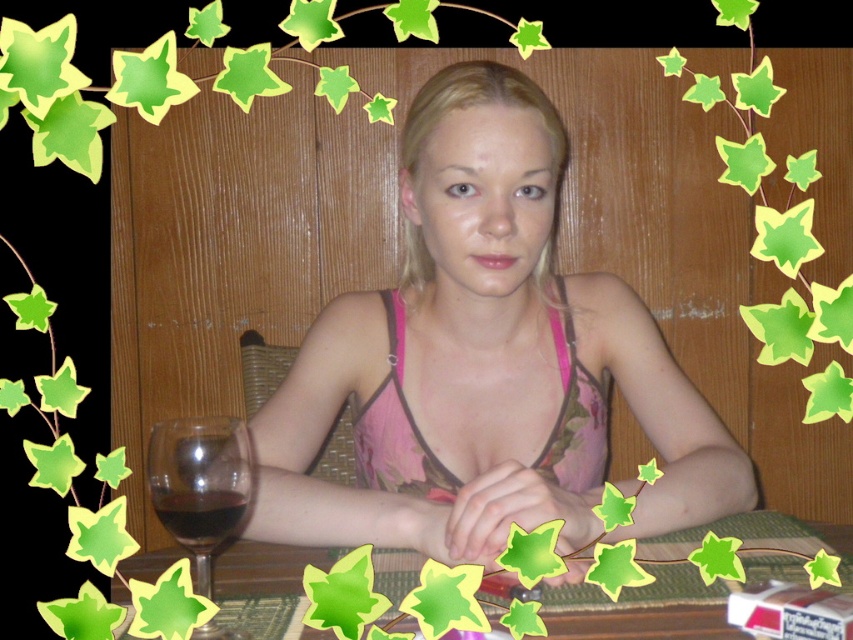
Is transparent glass at lower left positioned in front of dark red liquid at lower left?

Yes, transparent glass at lower left is closer to the viewer.

From the picture: Who is shorter, transparent glass at lower left or dark red liquid at lower left?

dark red liquid at lower left is shorter.

What do you see at coordinates (200, 483) in the screenshot?
I see `transparent glass at lower left` at bounding box center [200, 483].

You are a GUI agent. You are given a task and a screenshot of the screen. Output one action in this format:
    pyautogui.click(x=<x>, y=<y>)
    Task: Click on the transparent glass at lower left
    
    Given the screenshot: What is the action you would take?
    pyautogui.click(x=200, y=483)

Who is shorter, pink floral dress at center or dark red liquid at lower left?

Standing shorter between the two is dark red liquid at lower left.

This screenshot has height=640, width=853. I want to click on pink floral dress at center, so click(x=485, y=362).

What are the coordinates of `pink floral dress at center` in the screenshot? It's located at (485, 362).

Between point (403, 483) and point (158, 504), which one is positioned in front?

Point (158, 504) is more forward.

Does pink floral bikini top at center have a smaller size compared to dark red liquid at lower left?

No.

Who is more distant from viewer, (415, 428) or (167, 497)?

The point (415, 428) is more distant.

Identify the location of pink floral bikini top at center. (396, 428).